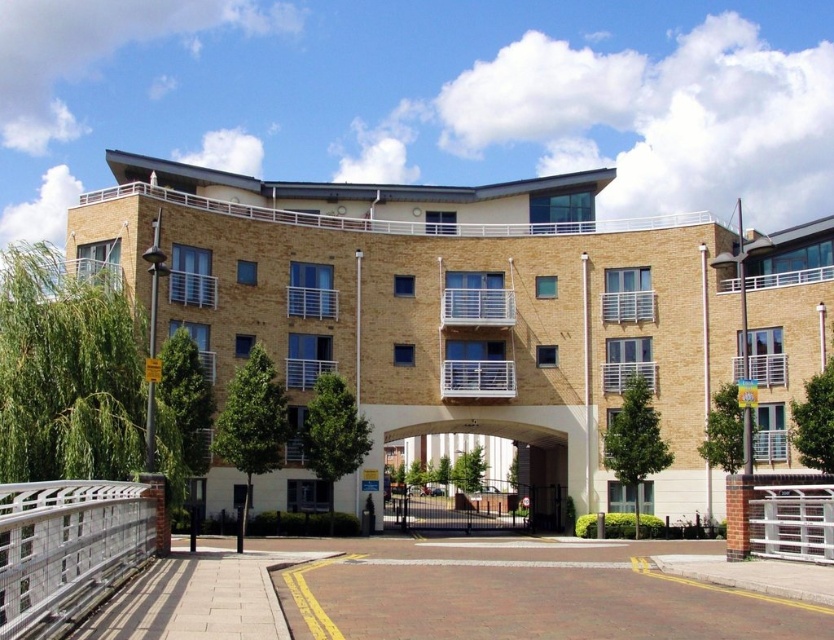
Question: Is beige brick building at center to the right of silver metallic rail at lower left from the viewer's perspective?

Choices:
 (A) yes
 (B) no

Answer: (A)

Question: Can you confirm if beige brick building at center is positioned above silver metallic rail at lower left?

Choices:
 (A) no
 (B) yes

Answer: (B)

Question: Can you confirm if beige brick building at center is positioned to the left of silver metallic rail at lower left?

Choices:
 (A) yes
 (B) no

Answer: (B)

Question: Among these points, which one is nearest to the camera?

Choices:
 (A) (627, 244)
 (B) (59, 506)

Answer: (B)